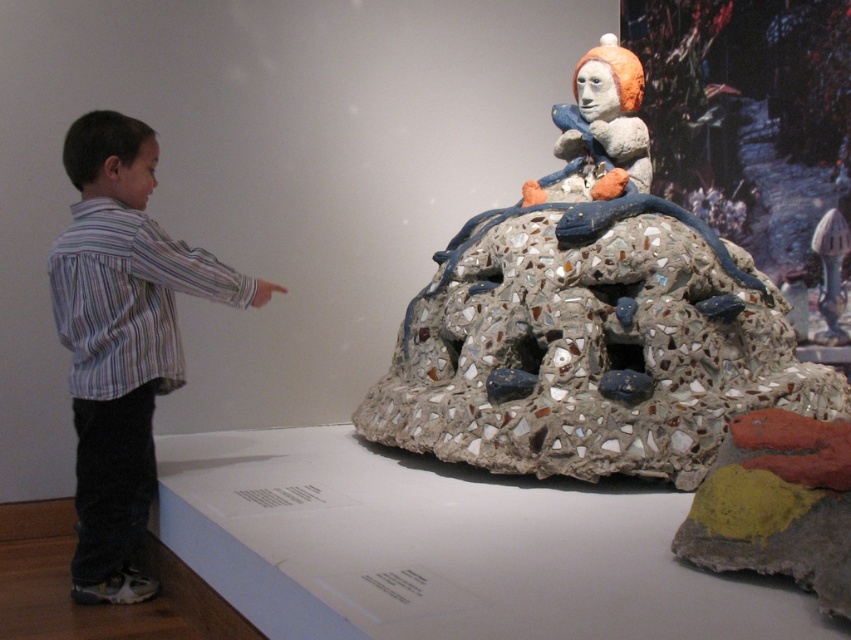
You are a visitor in the museum. You see the point marked at coordinates (x=592, y=321). What does this point indicate?

The point marked at coordinates (x=592, y=321) indicates the location of the mosaic stone sculpture at center.

In the museum scene, there is a mosaic stone sculpture at center and a striped shirt at left. Which object takes up more space in the image?

The mosaic stone sculpture at center is bigger than striped shirt at left, so it takes up more space in the image.